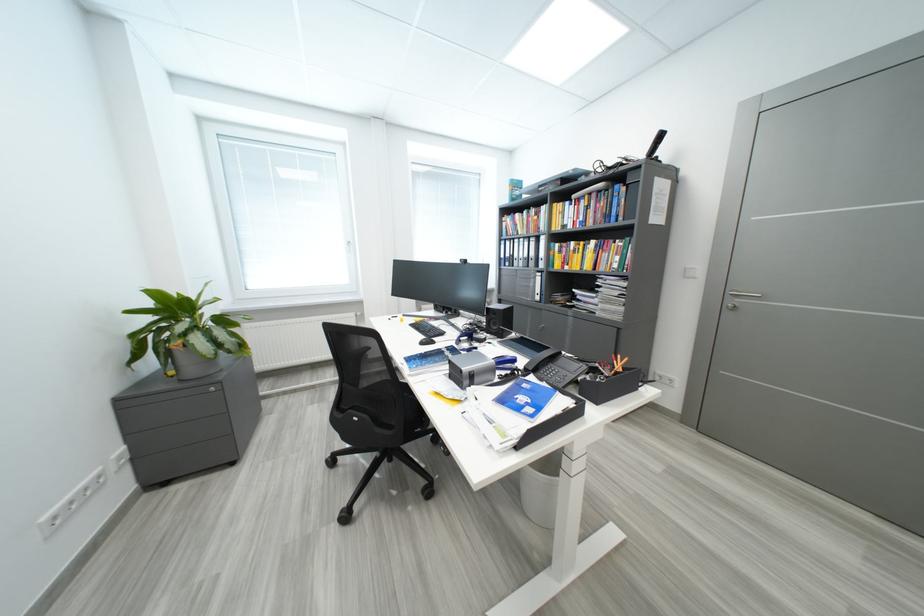
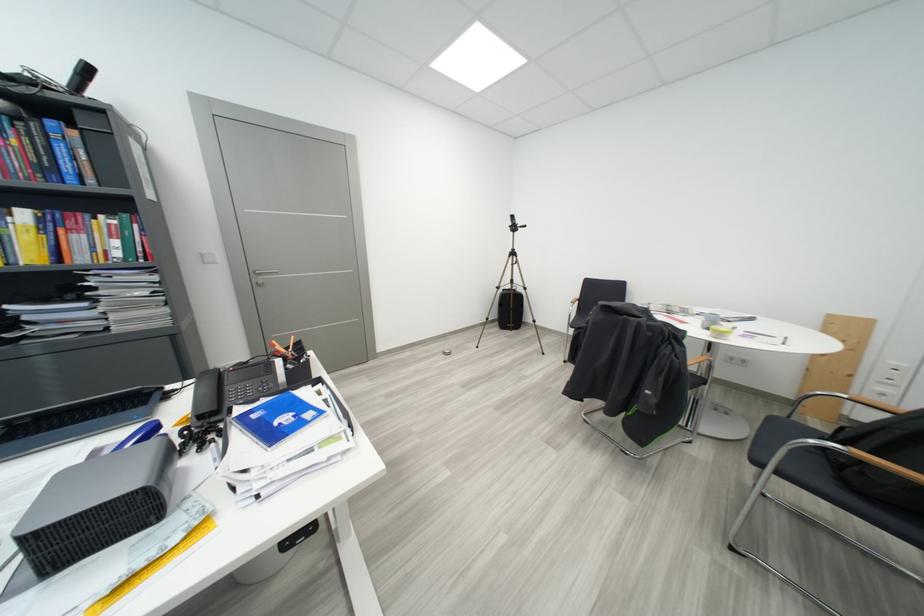
In the second image, find the point that corresponds to point 533,387 in the first image.

(263, 419)